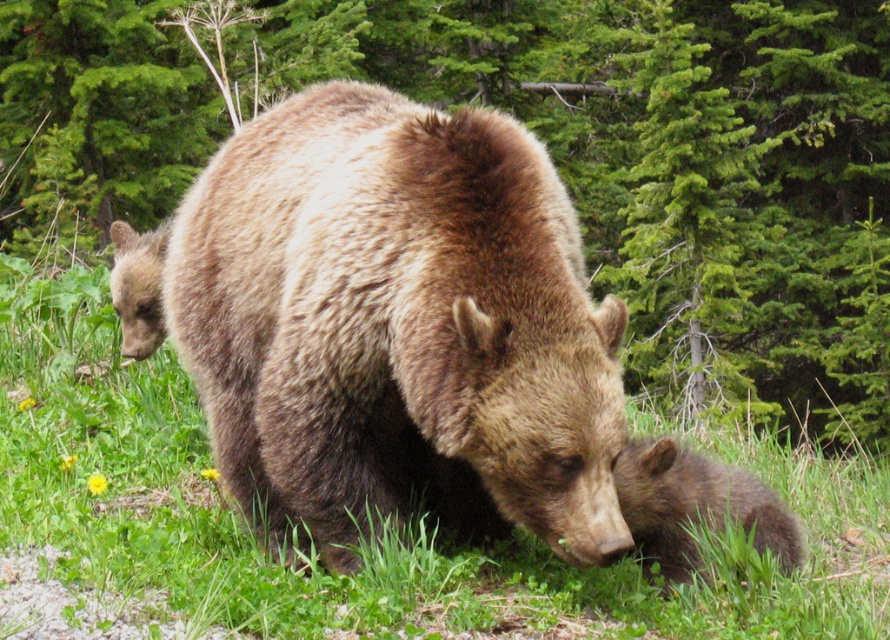
Is green leafy tree at upper center to the right of brown furry bear at center from the viewer's perspective?

Yes, green leafy tree at upper center is to the right of brown furry bear at center.

Does green leafy tree at upper center have a larger size compared to brown furry bear at center?

Correct, green leafy tree at upper center is larger in size than brown furry bear at center.

Between point (465, 83) and point (288, 374), which one is positioned behind?

Positioned behind is point (465, 83).

Where is `green leafy tree at upper center`? green leafy tree at upper center is located at coordinates [548, 148].